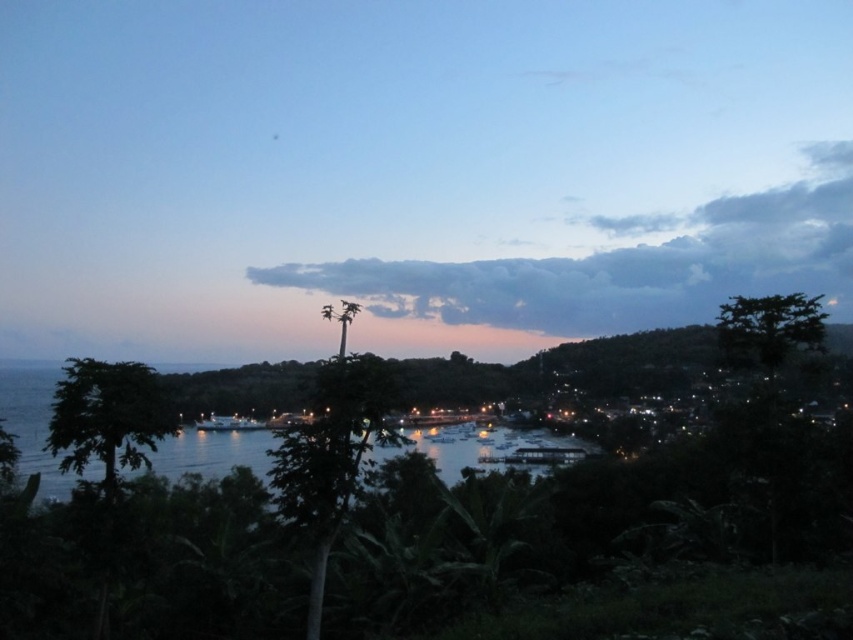
Looking at this image, can you confirm if green leafy tree at center is positioned above green leafy tree at left?

No, green leafy tree at center is not above green leafy tree at left.

Which is above, green leafy tree at center or green leafy tree at left?

green leafy tree at left is higher up.

Between point (314, 573) and point (135, 378), which one is positioned in front?

Point (314, 573) is more forward.

Identify the location of green leafy tree at center. This screenshot has height=640, width=853. (331, 451).